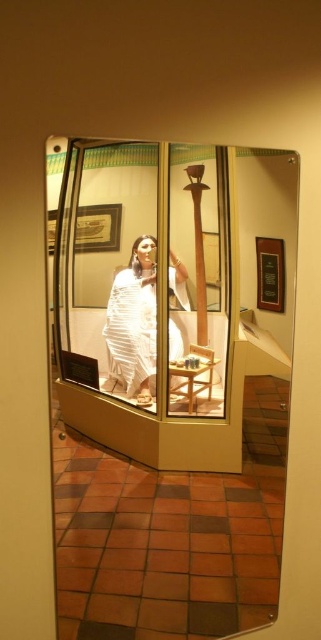
You are a visitor standing in front of the museum display case. You see the clear glass mirror at center and the white silk saree at center. Which object is closer to you?

The clear glass mirror at center is closer to the viewer than the white silk saree at center.

You are a museum visitor standing in front of the display case. You want to see the reflection of the white silk saree at center in the clear glass mirror at center. Can you see the entire saree reflected in the mirror?

The clear glass mirror at center is wider than the white silk saree at center, so yes, the entire saree can be seen reflected in the mirror.